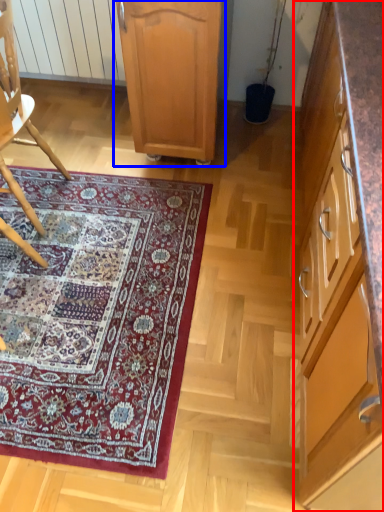
Question: Which object appears closest to the camera in this image, cabinetry (highlighted by a red box) or cabinetry (highlighted by a blue box)?

Choices:
 (A) cabinetry
 (B) cabinetry

Answer: (A)